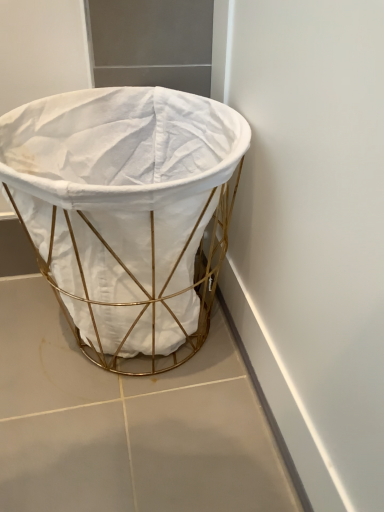
Describe the element at coordinates (126, 212) in the screenshot. I see `gold wire mesh basket at center` at that location.

I want to click on gold wire mesh basket at center, so click(x=126, y=212).

This screenshot has height=512, width=384. I want to click on gold wire mesh basket at center, so click(x=126, y=212).